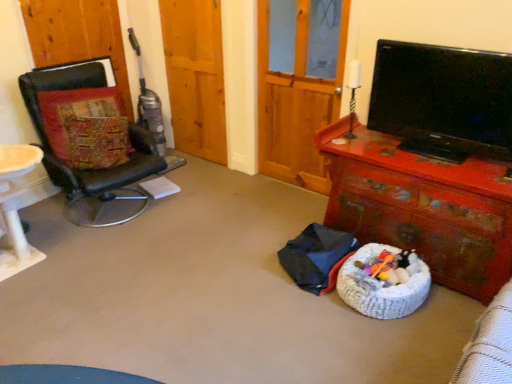
I want to click on free space below black leather chair at left (from a real-world perspective), so click(113, 213).